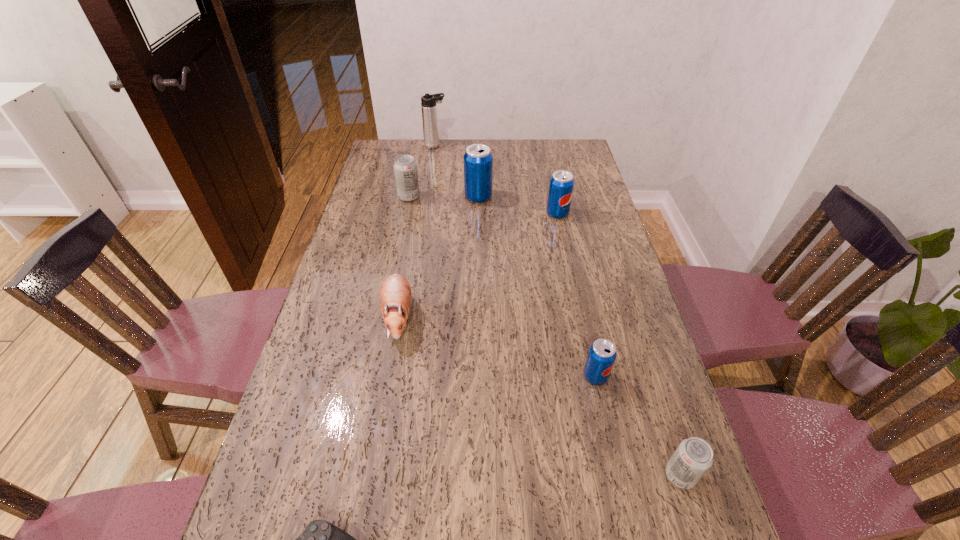
Point out which blue pop soda is positioned as the nearest to the nearest blue pop soda. Please provide its 2D coordinates. Your answer should be formatted as a tuple, i.e. [(x, y)], where the tuple contains the x and y coordinates of a point satisfying the conditions above.

[(561, 185)]

I want to click on free point that satisfies the following two spatial constraints: 1. at the face of the third nearest object; 2. on the right side of the fourth nearest object, so click(x=388, y=376).

The image size is (960, 540). Find the location of `vacant space that satisfies the following two spatial constraints: 1. on the front side of the leftmost soda can; 2. on the right side of the second tallest object`. vacant space that satisfies the following two spatial constraints: 1. on the front side of the leftmost soda can; 2. on the right side of the second tallest object is located at coordinates (409, 197).

You are a GUI agent. You are given a task and a screenshot of the screen. Output one action in this format:
    pyautogui.click(x=<x>, y=<y>)
    Task: Click on the free space that satisfies the following two spatial constraints: 1. on the back side of the smaller gray soda can; 2. on the handle side of the farthest object
    
    Given the screenshot: What is the action you would take?
    pyautogui.click(x=575, y=146)